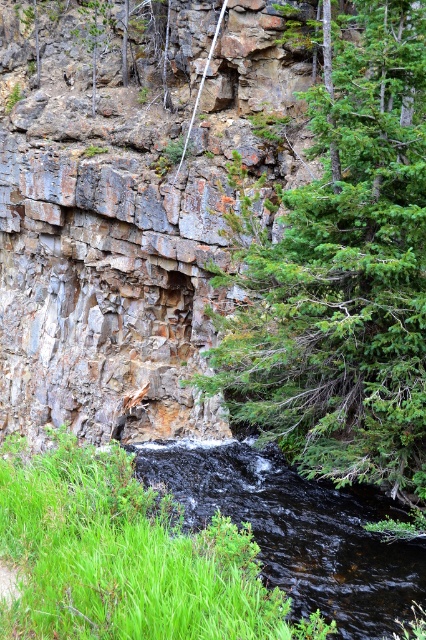
Question: Among these objects, which one is nearest to the camera?

Choices:
 (A) black glossy stream at lower left
 (B) green textured tree at center

Answer: (B)

Question: Does green textured tree at center come behind black glossy stream at lower left?

Choices:
 (A) no
 (B) yes

Answer: (A)

Question: Can you confirm if green textured tree at center is positioned to the right of black glossy stream at lower left?

Choices:
 (A) yes
 (B) no

Answer: (A)

Question: Which of the following is the closest to the observer?

Choices:
 (A) (186, 492)
 (B) (339, 330)

Answer: (B)

Question: Which of the following is the closest to the observer?

Choices:
 (A) green textured tree at center
 (B) black glossy stream at lower left

Answer: (A)

Question: Does green textured tree at center appear on the right side of black glossy stream at lower left?

Choices:
 (A) no
 (B) yes

Answer: (B)